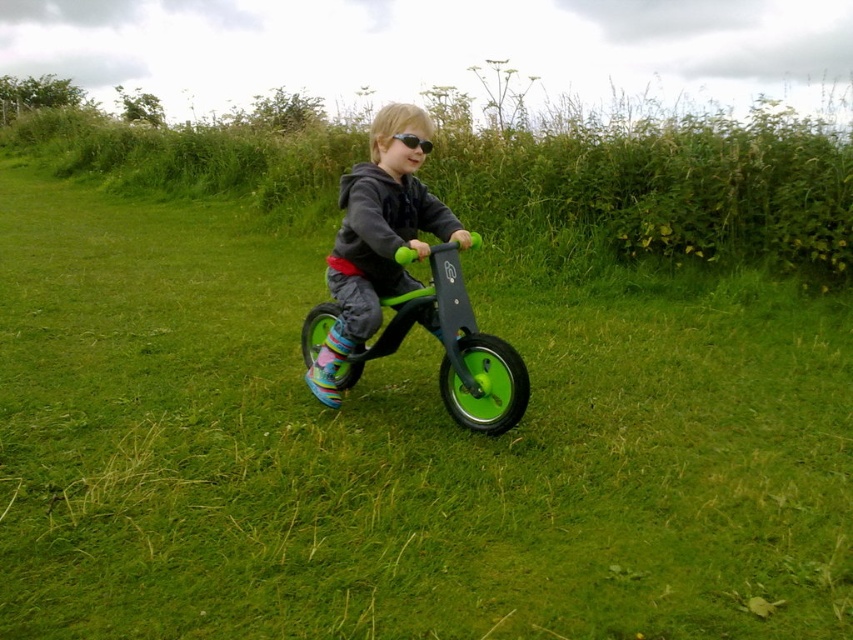
Does matte green bicycle at center have a lesser width compared to black matte goggles at center?

Incorrect, matte green bicycle at center's width is not less than black matte goggles at center's.

Find the location of a particular element. This screenshot has width=853, height=640. matte green bicycle at center is located at coordinates (376, 237).

Does point (358, 269) come farther from viewer compared to point (397, 134)?

Yes, point (358, 269) is farther from viewer.

Find the location of a particular element. This screenshot has height=640, width=853. matte green bicycle at center is located at coordinates (376, 237).

Between matte green bicycle at center and green rubber bicycle at center, which one is positioned higher?

matte green bicycle at center is higher up.

Who is more distant from viewer, (422,256) or (398,248)?

Point (422,256)

This screenshot has width=853, height=640. In order to click on matte green bicycle at center in this screenshot , I will do `click(376, 237)`.

Who is positioned more to the right, green rubber bicycle at center or black matte goggles at center?

Positioned to the right is black matte goggles at center.

Does green rubber bicycle at center appear under black matte goggles at center?

Yes, green rubber bicycle at center is below black matte goggles at center.

Between point (380, 348) and point (412, 144), which one is positioned behind?

The point (380, 348) is behind.

Where is `green rubber bicycle at center`? The height and width of the screenshot is (640, 853). green rubber bicycle at center is located at coordinates (451, 349).